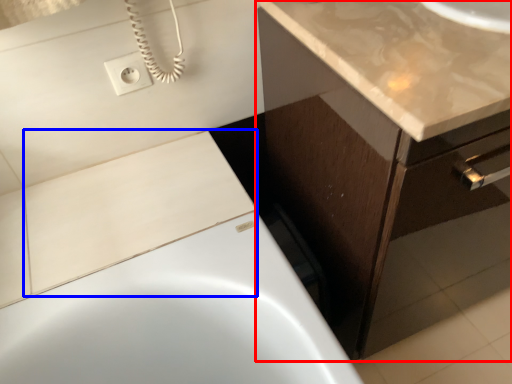
Question: Which of the following is the farthest to the observer, bathroom cabinet (highlighted by a red box) or tile (highlighted by a blue box)?

Choices:
 (A) bathroom cabinet
 (B) tile

Answer: (B)